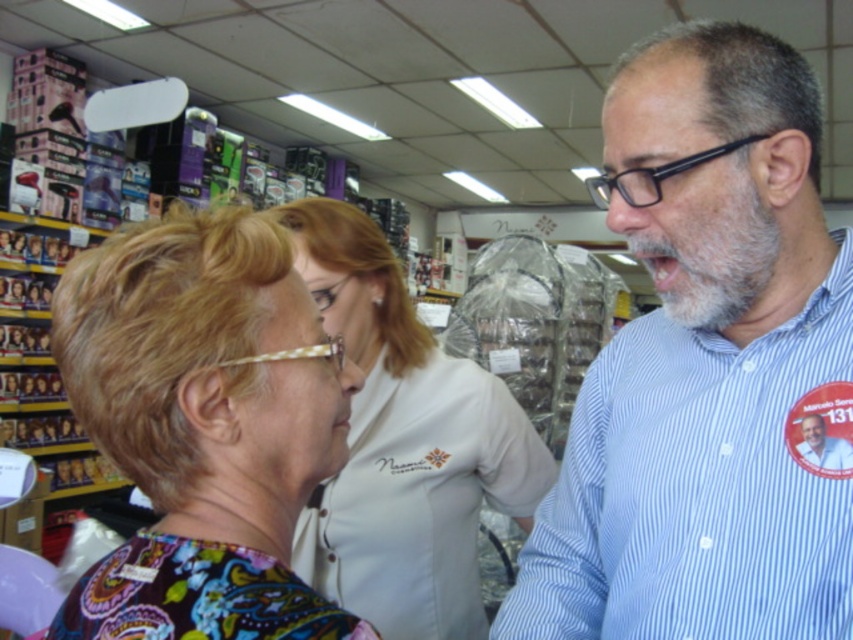
You are standing at the point at the coordinates point (x=419, y=344) and want to move to the other side of the store. There is a customer 1.26 meters away from you. Can you walk around them without getting too close?

Yes, since you and the customer are 1.26 meters apart, you can walk around them while maintaining a comfortable distance.

You are a fashion designer observing a group of people in a beauty store. You notice two clothing items worn by individuals in the center of the image. The first is a multicolored fabric blouse at center, and the second is a white fabric shirt at center. Which clothing item is shorter in length?

The multicolored fabric blouse at center has a lesser height compared to the white fabric shirt at center, so the multicolored fabric blouse at center is shorter in length.

You are a customer in the store and you want to ask the staff member wearing the blue striped shirt at right for help. However, there is another staff member in the blue striped shirt at center. Which staff member is taller?

The blue striped shirt at right is taller than the blue striped shirt at center.